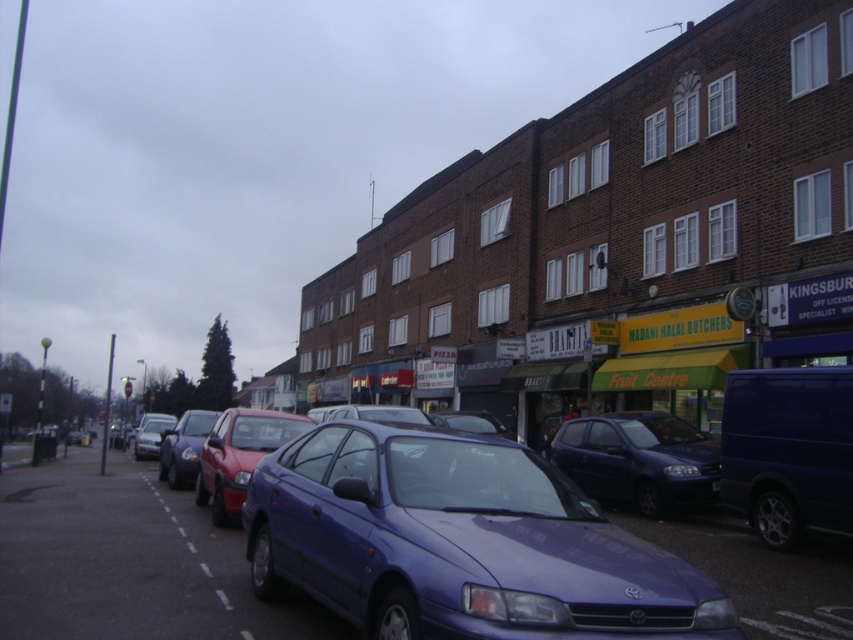
You are a delivery driver who needs to park your truck between the metallic blue sedan at center and the matte silver car at center. Is there enough space between them to fit your truck, which is 6 meters long?

The metallic blue sedan at center is larger in size than the matte silver car at center, but the exact distance between them isn not provided. Without knowing the space between the two cars, it is impossible to determine if the truck will fit.

You are a delivery driver who needs to park your 4.5 meter long truck between the shiny red car at center and the matte silver car at center. Can you fit your truck in the space between them?

The shiny red car at center is shorter than the matte silver car at center. However, the exact length of the space between them isn not provided. Without knowing the distance between the two cars, it is impossible to determine if the 4.5 meter truck can fit. Please measure the gap between the shiny red car at center and the matte silver car at center first.

You are a delivery person who needs to park your 2.5 meter wide delivery van between the glossy metallic car at center and the nearest parked car. Is there enough space between them for your van?

The space between the glossy metallic car at center and the nearest parked car is 3.57 meters. Since your van is 2.5 meters wide, there is sufficient space to park between them.